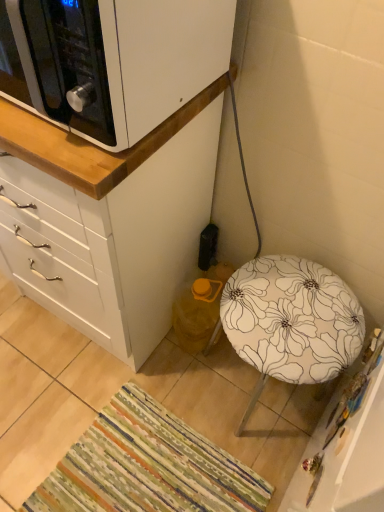
Question: Is multicolored woven mat at lower left directly adjacent to white floral fabric stool at lower right?

Choices:
 (A) yes
 (B) no

Answer: (B)

Question: Is multicolored woven mat at lower left bigger than white floral fabric stool at lower right?

Choices:
 (A) yes
 (B) no

Answer: (B)

Question: Considering the relative sizes of multicolored woven mat at lower left and white floral fabric stool at lower right in the image provided, is multicolored woven mat at lower left smaller than white floral fabric stool at lower right?

Choices:
 (A) yes
 (B) no

Answer: (A)

Question: Is multicolored woven mat at lower left taller than white floral fabric stool at lower right?

Choices:
 (A) no
 (B) yes

Answer: (A)

Question: From a real-world perspective, is multicolored woven mat at lower left on top of white floral fabric stool at lower right?

Choices:
 (A) no
 (B) yes

Answer: (A)

Question: Considering the positions of white matte cabinet at upper left and white matte cabinet at upper left in the image, is white matte cabinet at upper left wider or thinner than white matte cabinet at upper left?

Choices:
 (A) wide
 (B) thin

Answer: (B)

Question: Considering the positions of white matte cabinet at upper left and white matte cabinet at upper left in the image, is white matte cabinet at upper left taller or shorter than white matte cabinet at upper left?

Choices:
 (A) short
 (B) tall

Answer: (A)

Question: Would you say white matte cabinet at upper left is inside or outside white matte cabinet at upper left?

Choices:
 (A) inside
 (B) outside

Answer: (B)

Question: Considering the relative positions of white matte cabinet at upper left and white matte cabinet at upper left in the image provided, is white matte cabinet at upper left to the left or to the right of white matte cabinet at upper left?

Choices:
 (A) left
 (B) right

Answer: (B)

Question: From a real-world perspective, relative to white floral fabric stool at lower right, is white matte cabinet at upper left vertically above or below?

Choices:
 (A) below
 (B) above

Answer: (B)

Question: Based on their sizes in the image, would you say white matte cabinet at upper left is bigger or smaller than white floral fabric stool at lower right?

Choices:
 (A) big
 (B) small

Answer: (B)

Question: Considering the positions of white matte cabinet at upper left and white floral fabric stool at lower right in the image, is white matte cabinet at upper left taller or shorter than white floral fabric stool at lower right?

Choices:
 (A) tall
 (B) short

Answer: (B)

Question: In terms of width, does white matte cabinet at upper left look wider or thinner when compared to white floral fabric stool at lower right?

Choices:
 (A) thin
 (B) wide

Answer: (B)

Question: Looking at their shapes, would you say white matte cabinet at upper left is wider or thinner than multicolored woven mat at lower left?

Choices:
 (A) thin
 (B) wide

Answer: (A)

Question: Is point pyautogui.click(x=182, y=260) closer or farther from the camera than point pyautogui.click(x=261, y=494)?

Choices:
 (A) farther
 (B) closer

Answer: (A)